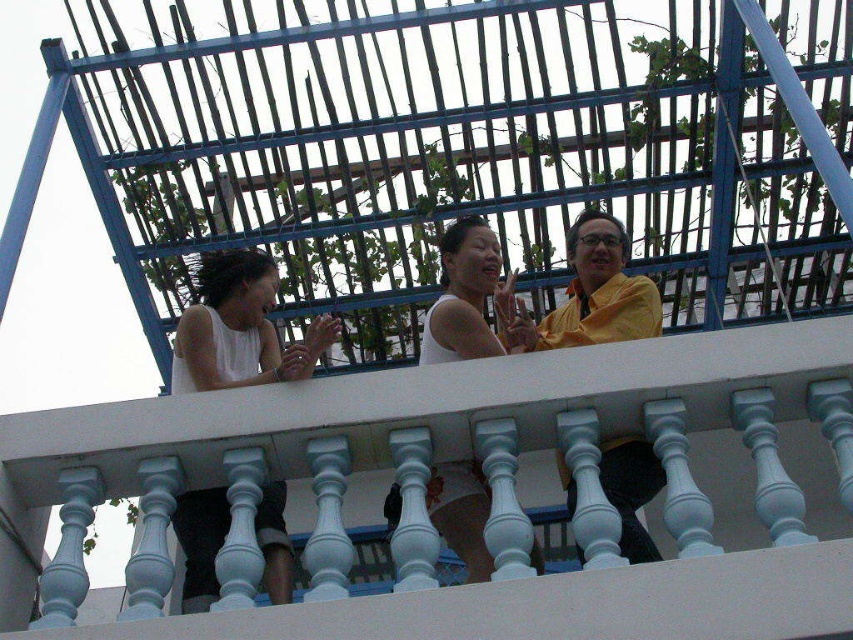
Question: Does white matte tank top at upper left have a lesser width compared to white matte tank top at center?

Choices:
 (A) no
 (B) yes

Answer: (A)

Question: Which of the following is the farthest from the observer?

Choices:
 (A) (196, 496)
 (B) (641, 324)

Answer: (B)

Question: Does white matte tank top at upper left have a lesser width compared to white matte tank top at center?

Choices:
 (A) no
 (B) yes

Answer: (A)

Question: Is yellow matte shirt at center positioned at the back of white matte tank top at center?

Choices:
 (A) yes
 (B) no

Answer: (B)

Question: Among these objects, which one is farthest from the camera?

Choices:
 (A) white matte tank top at center
 (B) white matte tank top at upper left
 (C) yellow matte shirt at center

Answer: (A)

Question: Considering the real-world distances, which object is closest to the yellow matte shirt at center?

Choices:
 (A) white matte tank top at upper left
 (B) white matte tank top at center

Answer: (B)